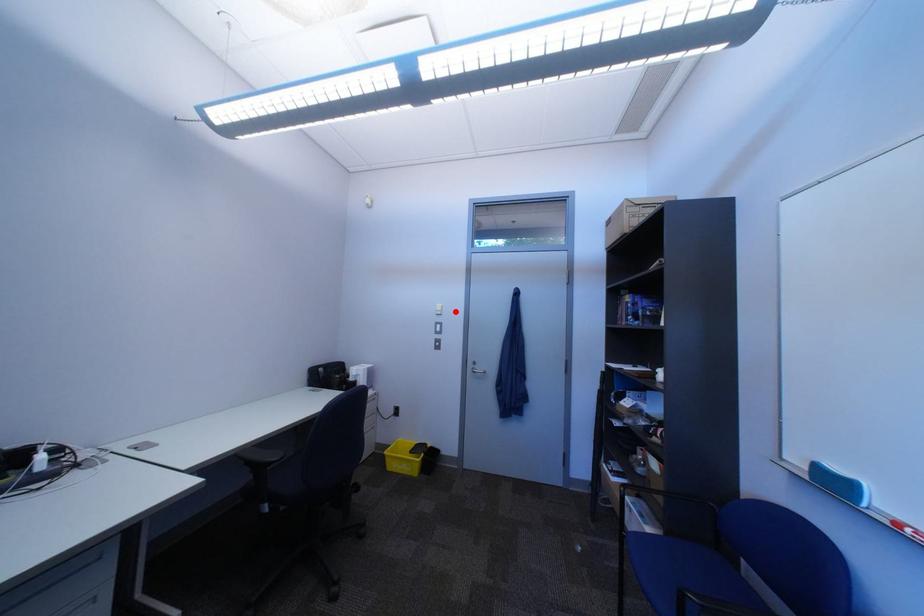
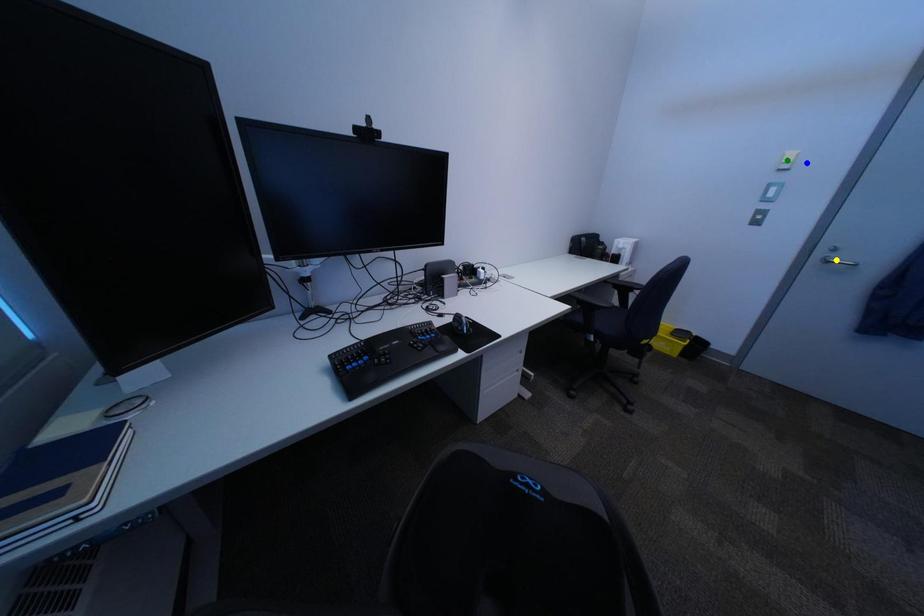
Question: I am providing you with two images of the same scene from different viewpoints. A red point is marked on the first image. You are given multiple points on the second image. Can you choose the point in image 2 that corresponds to the point in image 1?

Choices:
 (A) blue point
 (B) yellow point
 (C) green point

Answer: (A)